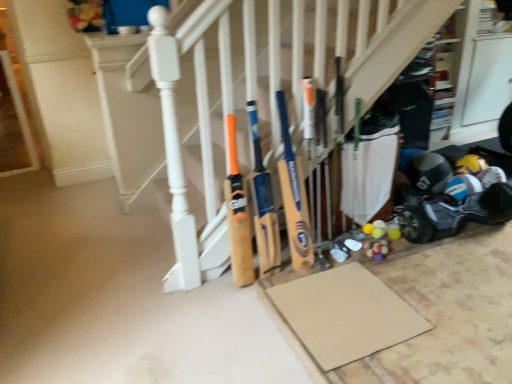
This screenshot has width=512, height=384. Identify the location of vacant position to the left of wooden bats at center. (109, 269).